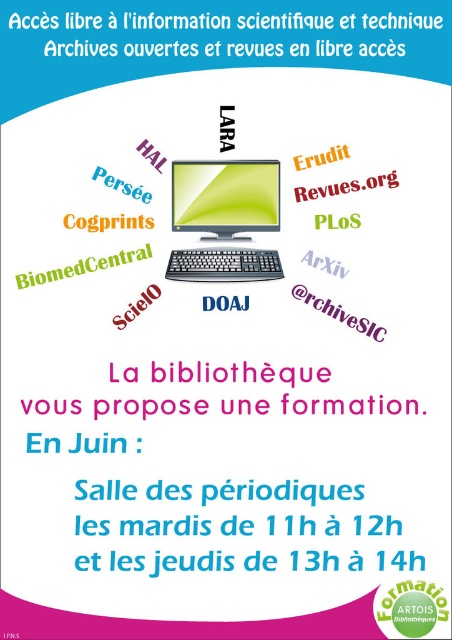
Question: Which point is farther from the camera taking this photo?

Choices:
 (A) (196, 180)
 (B) (199, 275)
 (C) (55, 269)

Answer: (A)

Question: Where is black plastic keyboard at center located in relation to green matte biomedcentral at center in the image?

Choices:
 (A) left
 (B) right

Answer: (B)

Question: Can you confirm if black plastic keyboard at center is smaller than green matte biomedcentral at center?

Choices:
 (A) no
 (B) yes

Answer: (A)

Question: Which point is closer to the camera?

Choices:
 (A) green matte biomedcentral at center
 (B) matte black monitor at center
 (C) black plastic keyboard at center
 (D) white paper at upper center

Answer: (C)

Question: Is white paper at upper center wider than green matte biomedcentral at center?

Choices:
 (A) no
 (B) yes

Answer: (B)

Question: Based on their relative distances, which object is farther from the matte black monitor at center?

Choices:
 (A) white paper at upper center
 (B) black plastic keyboard at center

Answer: (A)